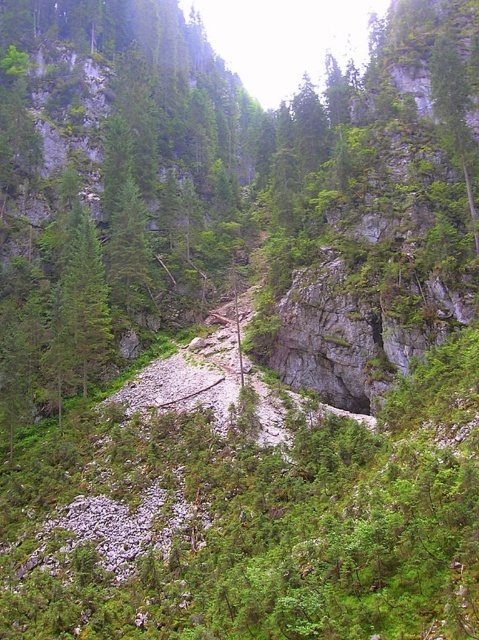
Is green matte tree at left positioned in front of green leafy tree at center?

Yes, green matte tree at left is closer to the viewer.

Who is more forward, (x=94, y=230) or (x=125, y=282)?

Point (x=94, y=230) is more forward.

In order to click on green matte tree at left in this screenshot , I will do pos(80,308).